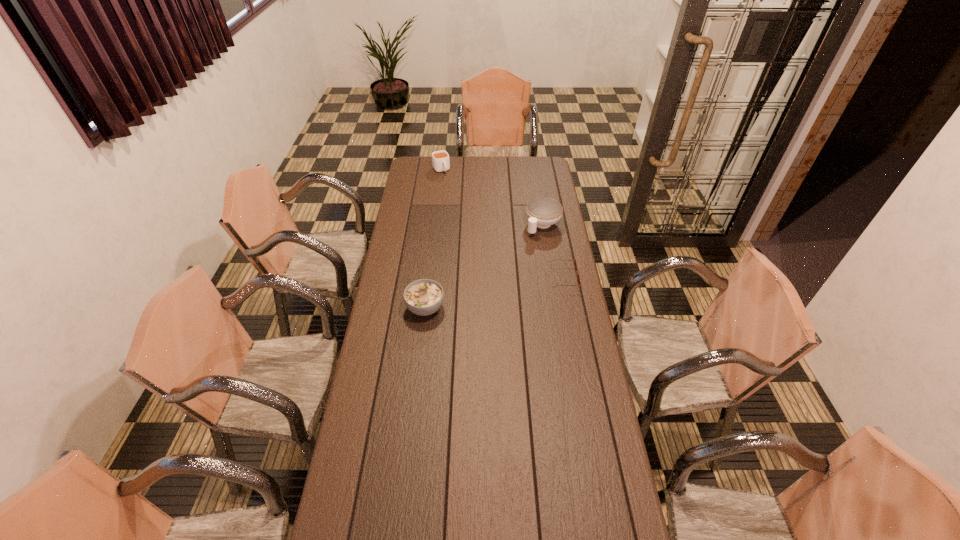
Find the location of `empty space that is in between the second farthest object and the sunglasses`. empty space that is in between the second farthest object and the sunglasses is located at coordinates click(553, 251).

Image resolution: width=960 pixels, height=540 pixels. What are the coordinates of `free spot between the third farthest object and the chinaware` in the screenshot? It's located at coord(553,251).

Locate an element on the screen. vacant point located between the second farthest object and the farthest object is located at coordinates (492, 198).

Point out which object is positioned as the second nearest to the sunglasses. Please provide its 2D coordinates. Your answer should be formatted as a tuple, i.e. [(x, y)], where the tuple contains the x and y coordinates of a point satisfying the conditions above.

[(423, 297)]

Select which object appears as the third closest to the shortest object. Please provide its 2D coordinates. Your answer should be formatted as a tuple, i.e. [(x, y)], where the tuple contains the x and y coordinates of a point satisfying the conditions above.

[(440, 159)]

This screenshot has height=540, width=960. I want to click on free point that satisfies the following two spatial constraints: 1. on the back side of the nearest object; 2. on the face of the second nearest object, so click(429, 276).

At what (x,y) coordinates should I click in order to perform the action: click on vacant point that satisfies the following two spatial constraints: 1. on the front side of the sunglasses; 2. on the face of the chinaware. Please return your answer as a coordinate pair (x, y). The height and width of the screenshot is (540, 960). Looking at the image, I should click on (551, 276).

Find the location of a particular element. The height and width of the screenshot is (540, 960). free location that satisfies the following two spatial constraints: 1. on the front side of the shortest object; 2. on the face of the cup is located at coordinates (429, 276).